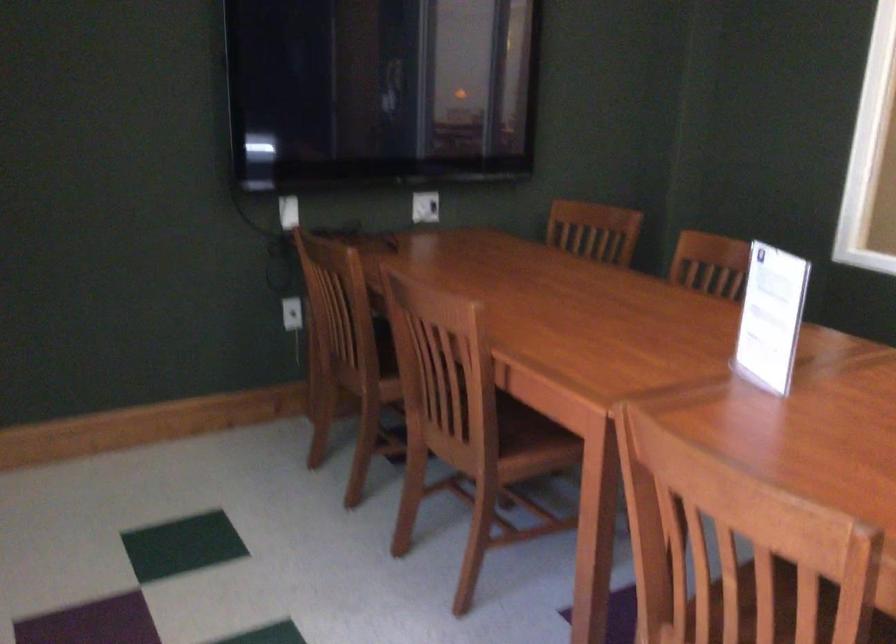
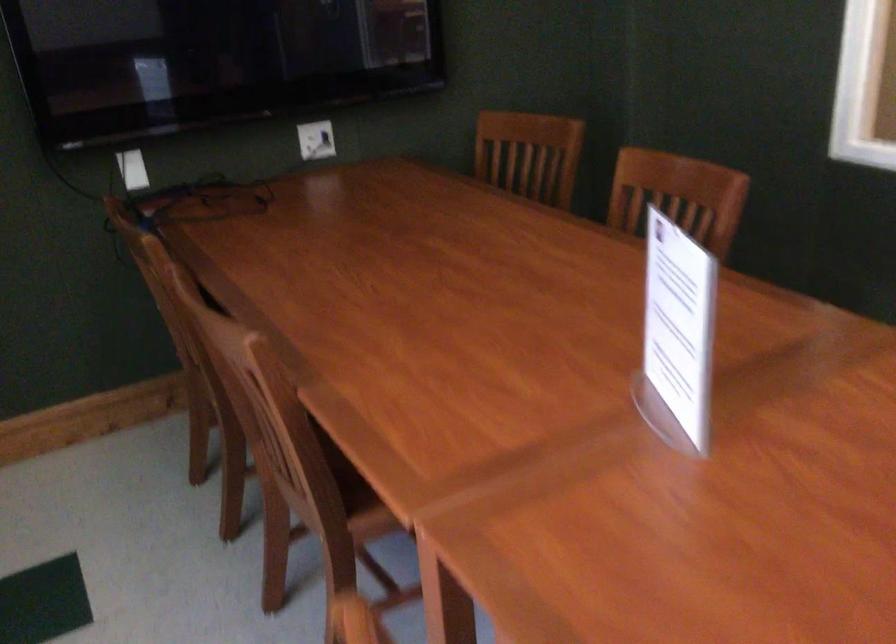
In the second image, find the point that corresponds to [596,230] in the first image.

(529, 154)